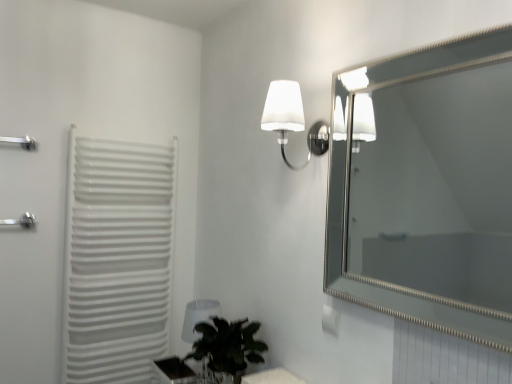
Image resolution: width=512 pixels, height=384 pixels. What do you see at coordinates (272, 377) in the screenshot?
I see `translucent glass table at lower center` at bounding box center [272, 377].

Where is `silver metallic shower at left`? The height and width of the screenshot is (384, 512). silver metallic shower at left is located at coordinates (21, 221).

The height and width of the screenshot is (384, 512). Find the location of `white glossy electric outlet at upper center`. white glossy electric outlet at upper center is located at coordinates (330, 320).

Where is `silver/metallic mirror at upper right`? The height and width of the screenshot is (384, 512). silver/metallic mirror at upper right is located at coordinates pos(438,188).

Are transparent plastic table lamp at lower center and white glossy electric outlet at upper center making contact?

There is a gap between transparent plastic table lamp at lower center and white glossy electric outlet at upper center.

Between transparent plastic table lamp at lower center and white glossy electric outlet at upper center, which one has larger size?

transparent plastic table lamp at lower center is bigger.

Identify the location of table lamp below the white glossy electric outlet at upper center (from a real-world perspective). (198, 317).

Is silver/metallic mirror at upper right thinner than silver metallic shower at left?

Yes, silver/metallic mirror at upper right is thinner than silver metallic shower at left.

From the image's perspective, is silver/metallic mirror at upper right on top of silver metallic shower at left?

Yes.

In the scene shown: Who is smaller, silver/metallic mirror at upper right or silver metallic shower at left?

Smaller between the two is silver metallic shower at left.

From a real-world perspective, is silver/metallic mirror at upper right physically located above or below silver metallic shower at left?

silver/metallic mirror at upper right is above silver metallic shower at left.

Is point (26, 144) closer or farther from the camera than point (293, 102)?

Point (26, 144) is positioned farther from the camera compared to point (293, 102).

Considering the relative sizes of silver metallic towel bar at left and white frosted glass wall sconce at upper center in the image provided, is silver metallic towel bar at left taller than white frosted glass wall sconce at upper center?

No.

Which of these two, silver metallic towel bar at left or white frosted glass wall sconce at upper center, is thinner?

Thinner between the two is silver metallic towel bar at left.

From the image's perspective, which is above, silver metallic towel bar at left or white frosted glass wall sconce at upper center?

silver metallic towel bar at left appears higher in the image.

Would you say green leafy plant at lower center is a long distance from silver metallic towel bar at left?

Yes, green leafy plant at lower center and silver metallic towel bar at left are located far from each other.

Which object is thinner, green leafy plant at lower center or silver metallic towel bar at left?

With smaller width is silver metallic towel bar at left.

Is point (215, 318) farther from camera compared to point (28, 142)?

No, (215, 318) is in front of (28, 142).

Where is `electric outlet that appears above the transparent plastic table lamp at lower center (from a real-world perspective)`? The image size is (512, 384). electric outlet that appears above the transparent plastic table lamp at lower center (from a real-world perspective) is located at coordinates (330, 320).

Does point (335, 316) come farther from viewer compared to point (192, 306)?

No, it is in front of (192, 306).

What's the angular difference between white glossy electric outlet at upper center and transparent plastic table lamp at lower center's facing directions?

The angular difference between white glossy electric outlet at upper center and transparent plastic table lamp at lower center is 0.409 degrees.

Is white glossy electric outlet at upper center placed right next to transparent plastic table lamp at lower center?

There is a gap between white glossy electric outlet at upper center and transparent plastic table lamp at lower center.

This screenshot has width=512, height=384. Identify the location of mirror lying below the silver metallic towel bar at left (from the image's perspective). (438, 188).

Is silver/metallic mirror at upper right aimed at silver metallic towel bar at left?

No, silver/metallic mirror at upper right is not facing towards silver metallic towel bar at left.

Considering the sizes of silver/metallic mirror at upper right and silver metallic towel bar at left in the image, is silver/metallic mirror at upper right wider or thinner than silver metallic towel bar at left?

Clearly, silver/metallic mirror at upper right has less width compared to silver metallic towel bar at left.

Is silver/metallic mirror at upper right at the left side of silver metallic towel bar at left?

No.

Could you tell me if white plastic radiator at left is facing silver/metallic mirror at upper right?

Yes, white plastic radiator at left faces towards silver/metallic mirror at upper right.

Is point (150, 308) closer or farther from the camera than point (509, 122)?

Point (150, 308).

Is white plastic radiator at left wider than silver/metallic mirror at upper right?

Correct, the width of white plastic radiator at left exceeds that of silver/metallic mirror at upper right.

Are white plastic radiator at left and silver/metallic mirror at upper right located far from each other?

Yes, white plastic radiator at left and silver/metallic mirror at upper right are quite far apart.

The width and height of the screenshot is (512, 384). I want to click on table lamp below the white glossy electric outlet at upper center (from the image's perspective), so click(x=198, y=317).

I want to click on mirror above the silver metallic shower at left (from the image's perspective), so click(438, 188).

Based on their spatial positions, is white plastic radiator at left or silver metallic towel bar at left further from white glossy electric outlet at upper center?

The object further to white glossy electric outlet at upper center is silver metallic towel bar at left.

Based on their spatial positions, is silver metallic towel bar at left or white frosted glass wall sconce at upper center closer to silver metallic shower at left?

silver metallic towel bar at left.

Based on their spatial positions, is green leafy plant at lower center or silver metallic towel bar at left closer to transparent plastic table lamp at lower center?

green leafy plant at lower center.

When comparing their distances from translucent glass table at lower center, does white plastic radiator at left or silver metallic towel bar at left seem further?

silver metallic towel bar at left.

Considering their positions, is transparent plastic table lamp at lower center positioned further to white glossy electric outlet at upper center than translucent glass table at lower center?

transparent plastic table lamp at lower center is further to white glossy electric outlet at upper center.

Based on their spatial positions, is transparent plastic table lamp at lower center or white plastic radiator at left further from silver/metallic mirror at upper right?

transparent plastic table lamp at lower center is further to silver/metallic mirror at upper right.

Considering their positions, is white glossy electric outlet at upper center positioned closer to green leafy plant at lower center than silver/metallic mirror at upper right?

Based on the image, white glossy electric outlet at upper center appears to be nearer to green leafy plant at lower center.

From the image, which object appears to be nearer to white frosted glass wall sconce at upper center, silver metallic towel bar at left or transparent plastic table lamp at lower center?

transparent plastic table lamp at lower center is closer to white frosted glass wall sconce at upper center.

Find the location of a particular element. The width and height of the screenshot is (512, 384). houseplant between white plastic radiator at left and silver/metallic mirror at upper right is located at coordinates (227, 345).

I want to click on table lamp located between silver metallic towel bar at left and translucent glass table at lower center in the left-right direction, so click(x=198, y=317).

This screenshot has height=384, width=512. Find the location of `towel bar located between silver metallic shower at left and silver/metallic mirror at upper right in the left-right direction`. towel bar located between silver metallic shower at left and silver/metallic mirror at upper right in the left-right direction is located at coordinates (21, 142).

This screenshot has width=512, height=384. In order to click on houseplant between silver metallic towel bar at left and white glossy electric outlet at upper center in the horizontal direction in this screenshot , I will do `click(227, 345)`.